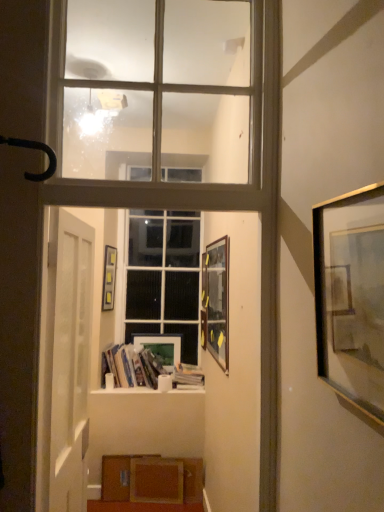
Question: From the image's perspective, is clear glass window at upper center, which is the 1th window in top-to-bottom order, positioned above or below white paper stack at center, the second book from the left?

Choices:
 (A) below
 (B) above

Answer: (B)

Question: Would you say clear glass window at upper center, which is counted as the 1th window, starting from the front, is inside or outside white paper stack at center, the second book from the left?

Choices:
 (A) outside
 (B) inside

Answer: (A)

Question: Which object is the farthest from the white paper stack at center, the first book positioned from the right?

Choices:
 (A) white glass window at center, the first window in the bottom-to-top sequence
 (B) gold metallic picture frame at right, the 4th picture frame viewed from the left
 (C) hardcover books at center, the first book in the left-to-right sequence
 (D) white matte door at left
 (E) wooden picture frame at center, the 2th picture frame in the right-to-left sequence

Answer: (B)

Question: Which of these objects is positioned closest to the matte plastic picture frame at upper center, positioned as the 1th picture frame in left-to-right order?

Choices:
 (A) white glass window at center, acting as the 1th window starting from the back
 (B) wooden picture frame at center, which ranks as the third picture frame in left-to-right order
 (C) matte wooden picture frame at center, the 1th picture frame viewed from the back
 (D) clear glass window at upper center, the 2th window when ordered from back to front
 (E) gold metallic picture frame at right, positioned as the 1th picture frame in front-to-back order

Answer: (A)